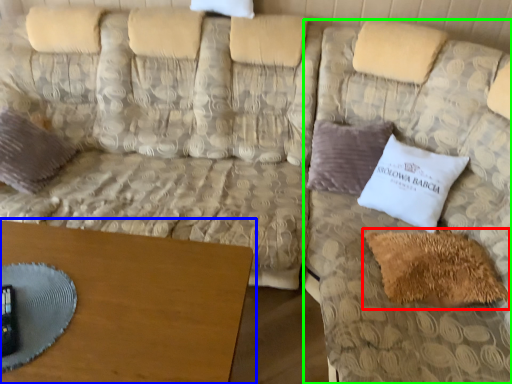
Question: Which object is the closest to the pillow (highlighted by a red box)? Choose among these: table (highlighted by a blue box) or couch (highlighted by a green box).

Choices:
 (A) table
 (B) couch

Answer: (B)